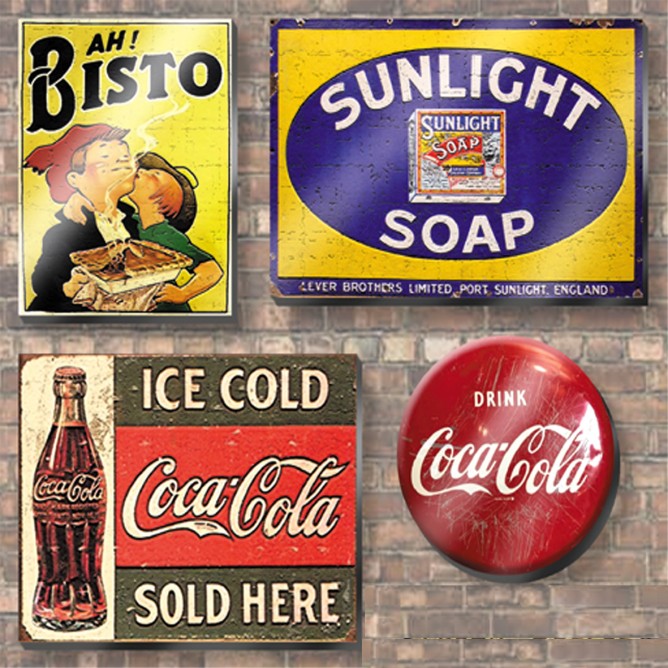
Locate an element on the screen. fake brick wall is located at coordinates (464, 637).